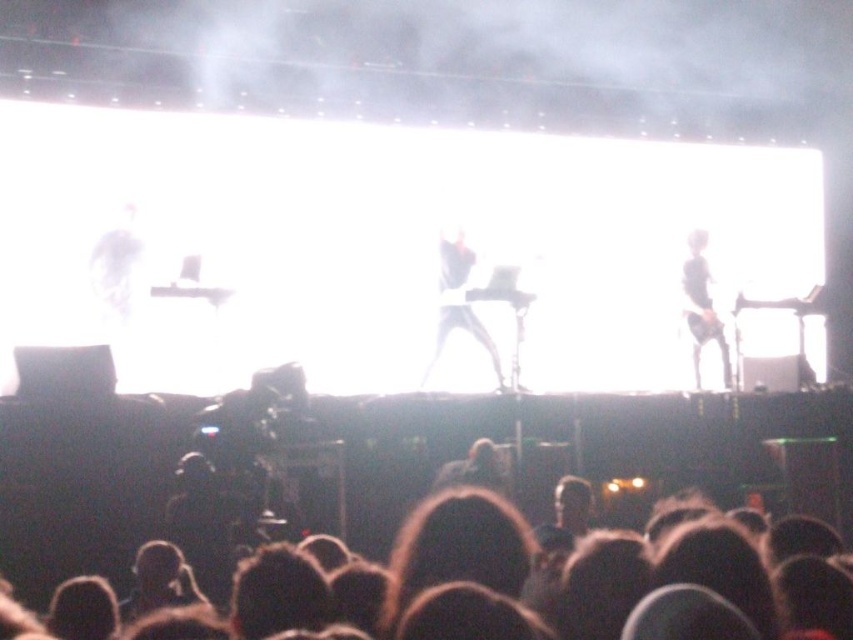
Is black matte guitar at center bigger than black matte guitar at right?

Correct, black matte guitar at center is larger in size than black matte guitar at right.

Is point (425, 381) less distant than point (693, 368)?

Yes, point (425, 381) is in front of point (693, 368).

Where is `black matte guitar at center`? Image resolution: width=853 pixels, height=640 pixels. black matte guitar at center is located at coordinates (457, 300).